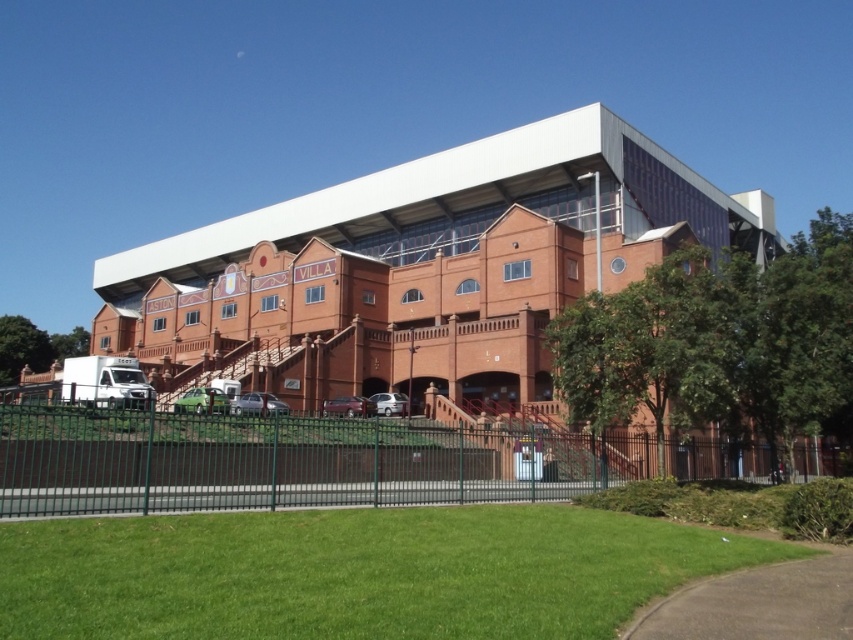
Question: From the image, what is the correct spatial relationship of green grass at lower center in relation to green metal fence at lower center?

Choices:
 (A) right
 (B) left

Answer: (B)

Question: Does green grass at lower center appear under green metal fence at lower center?

Choices:
 (A) no
 (B) yes

Answer: (B)

Question: Can you confirm if green grass at lower center is thinner than green metal fence at lower center?

Choices:
 (A) no
 (B) yes

Answer: (B)

Question: Among these objects, which one is nearest to the camera?

Choices:
 (A) green metal fence at lower center
 (B) green grass at lower center

Answer: (B)

Question: Among these points, which one is farthest from the camera?

Choices:
 (A) (695, 548)
 (B) (287, 452)

Answer: (B)